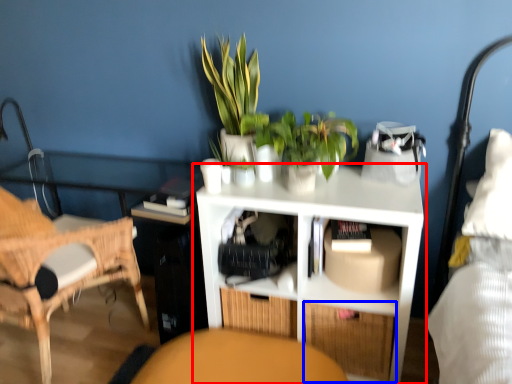
Question: Which object appears farthest to the camera in this image, shelf (highlighted by a red box) or drawer (highlighted by a blue box)?

Choices:
 (A) shelf
 (B) drawer

Answer: (B)